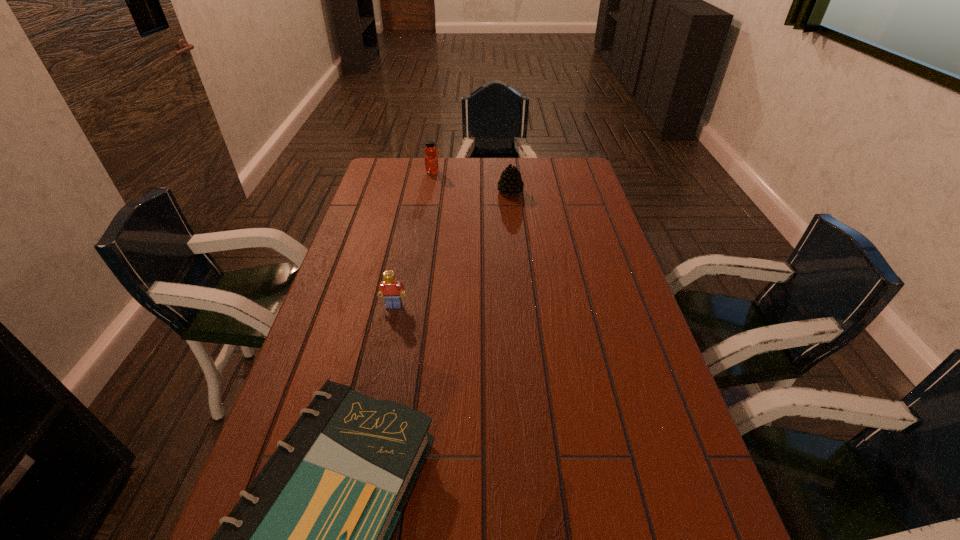
Where is `the farthest object`? the farthest object is located at coordinates (431, 161).

Find the location of a particular element. The image size is (960, 540). Lego is located at coordinates (390, 288).

Locate an element on the screen. pinecone is located at coordinates (510, 183).

Image resolution: width=960 pixels, height=540 pixels. I want to click on the rightmost object, so click(510, 183).

Where is `free location located 0.120m on the front label of the farthest object`? The height and width of the screenshot is (540, 960). free location located 0.120m on the front label of the farthest object is located at coordinates (470, 172).

The image size is (960, 540). In order to click on free space located on the front-facing side of the third farthest object in this screenshot , I will do point(375,395).

The height and width of the screenshot is (540, 960). Identify the location of free space located 0.310m at the narrow end of the third nearest object. (414, 192).

This screenshot has width=960, height=540. Identify the location of free location located at the narrow end of the third nearest object. (390, 192).

Locate an element on the screen. This screenshot has width=960, height=540. vacant position located at the narrow end of the third nearest object is located at coordinates (436, 192).

What are the coordinates of `honey present at the far edge` in the screenshot? It's located at (431, 161).